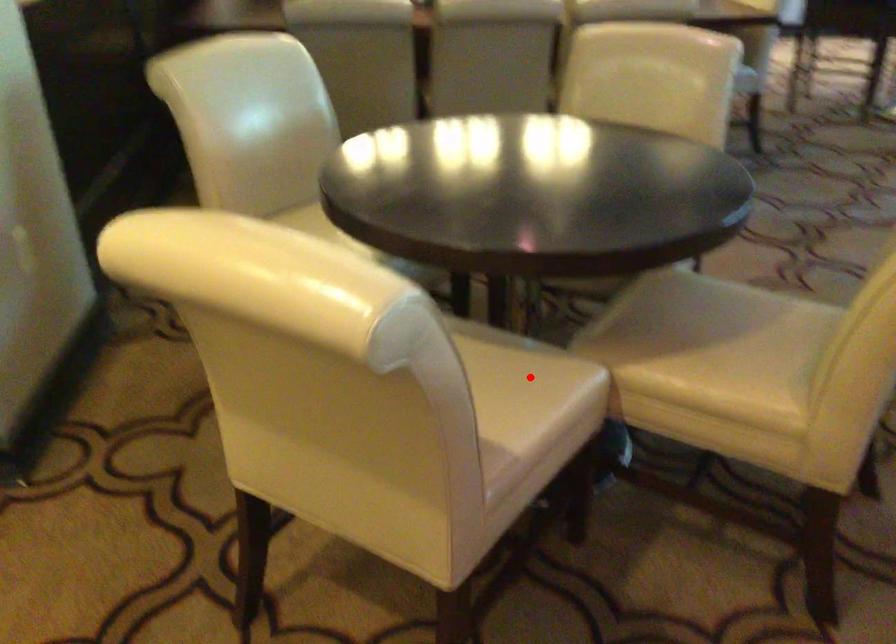
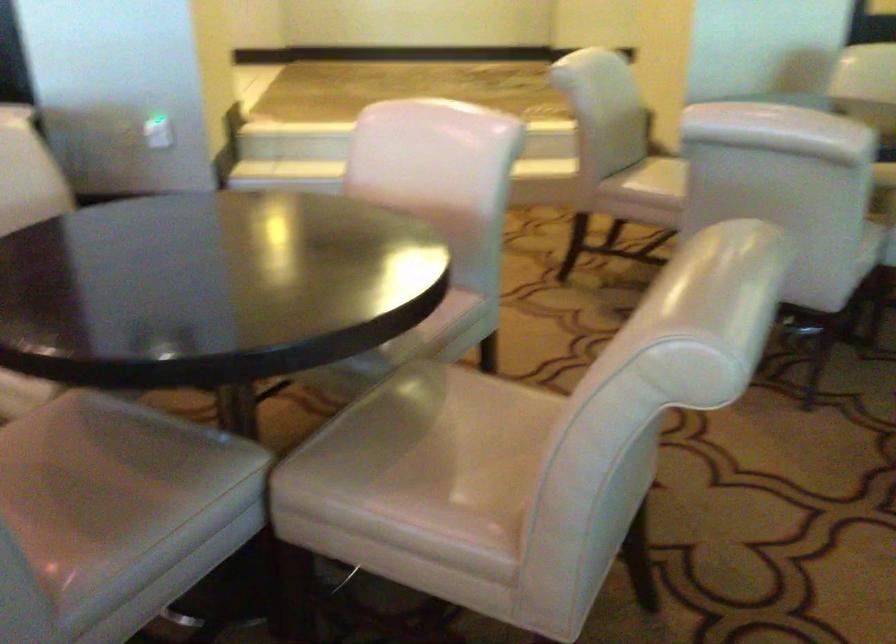
Question: I am providing you with two images of the same scene from different viewpoints. A red point is marked on the first image. Is the red point's position out of view in image 2?

Choices:
 (A) Yes
 (B) No

Answer: (A)